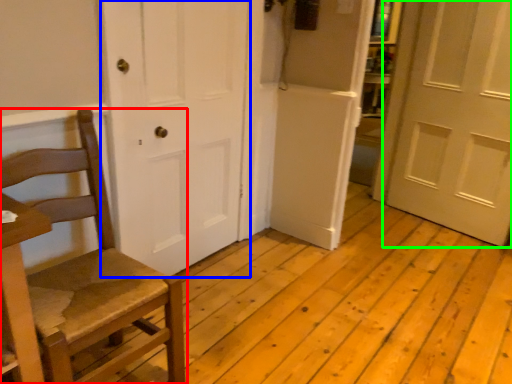
Question: Which object is positioned farthest from chair (highlighted by a red box)? Select from door (highlighted by a blue box) and door (highlighted by a green box).

Choices:
 (A) door
 (B) door

Answer: (B)